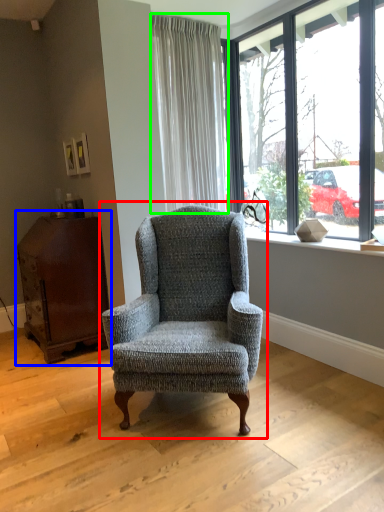
Question: Which is nearer to the chair (highlighted by a red box)? dresser (highlighted by a blue box) or curtain (highlighted by a green box).

Choices:
 (A) dresser
 (B) curtain

Answer: (A)